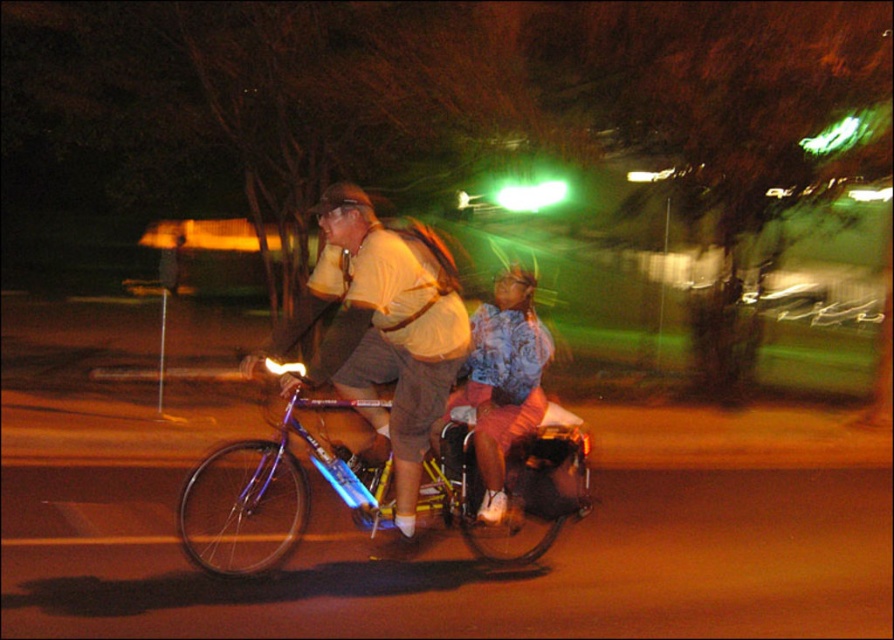
Question: Which of the following is the closest to the observer?

Choices:
 (A) blue floral shirt at center
 (B) matte yellow shirt at center

Answer: (B)

Question: Which point is closer to the camera?

Choices:
 (A) matte yellow shirt at center
 (B) shiny metallic bicycle at center
 (C) blue floral shirt at center

Answer: (A)

Question: Which of these objects is positioned closest to the matte yellow shirt at center?

Choices:
 (A) blue floral shirt at center
 (B) shiny metallic bicycle at center

Answer: (A)

Question: Where is matte yellow shirt at center located in relation to blue floral shirt at center in the image?

Choices:
 (A) below
 (B) above

Answer: (B)

Question: Does shiny metallic bicycle at center appear on the left side of blue floral shirt at center?

Choices:
 (A) yes
 (B) no

Answer: (A)

Question: Can you confirm if matte yellow shirt at center is smaller than blue floral shirt at center?

Choices:
 (A) yes
 (B) no

Answer: (B)